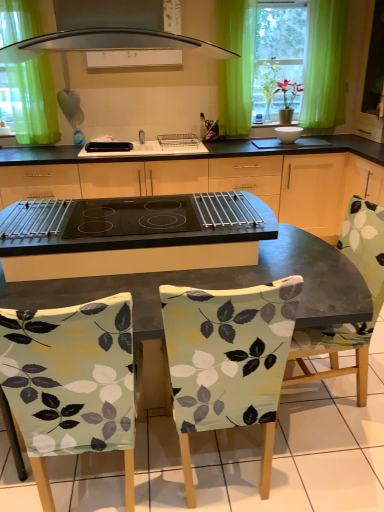
Find the location of a particular element. free point below green fabric curtain at upper left, the 2th curtain in the right-to-left sequence (from a real-world perspective) is located at coordinates (51, 143).